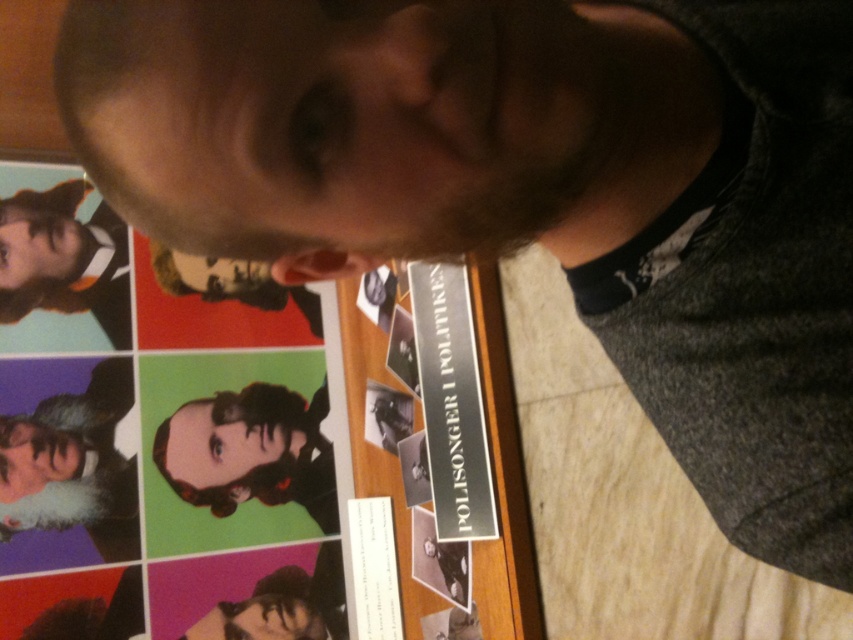
You are a visitor at the exhibition and want to take a photo of the white beard at lower left and the matte black beard at upper left. The camera you have can only focus on objects within 15 inches of each other. Can you capture both in one shot without moving the camera?

The distance between the white beard at lower left and the matte black beard at upper left is 14.69 inches, which is within the 15 inches focus range. Therefore, you can capture both in one shot without moving the camera.

You are a photographer taking a picture of the white beard at lower left and the matte black beard at upper left. Which beard will appear larger in the photo?

The white beard at lower left will appear larger in the photo because it is much taller than the matte black beard at upper left.